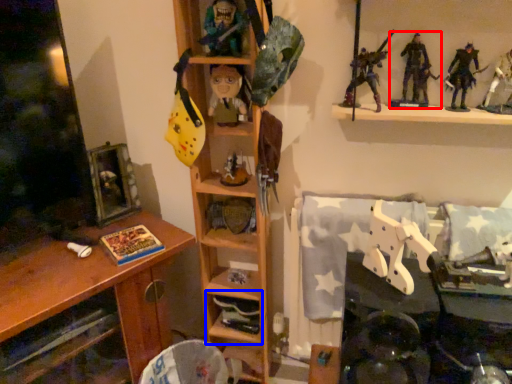
Question: Which object is closer to the camera taking this photo, toy (highlighted by a red box) or shelf (highlighted by a blue box)?

Choices:
 (A) toy
 (B) shelf

Answer: (A)